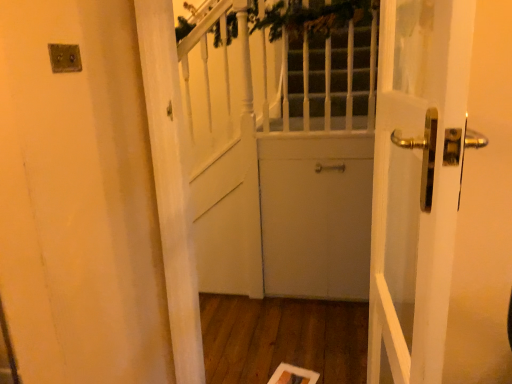
In order to click on gold polished door handle at right in this screenshot , I will do `click(442, 196)`.

The image size is (512, 384). What do you see at coordinates (442, 196) in the screenshot? I see `gold polished door handle at right` at bounding box center [442, 196].

Measure the distance between point (496,243) and camera.

1.46 meters.

I want to click on gold polished door handle at right, so click(442, 196).